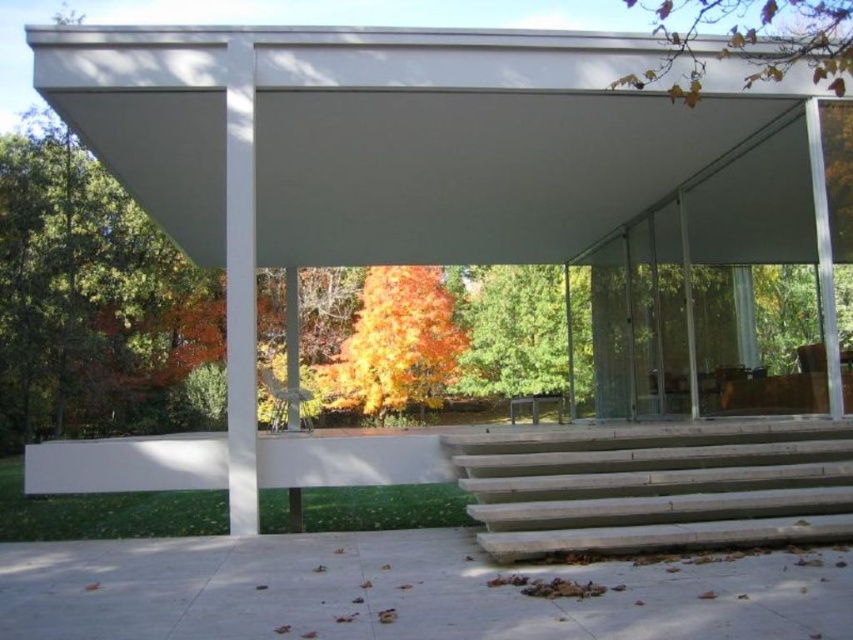
Question: Is white matte canopy at upper center in front of concrete stairs at lower right?

Choices:
 (A) no
 (B) yes

Answer: (A)

Question: Does white matte canopy at upper center have a greater width compared to orange leafy tree at center?

Choices:
 (A) yes
 (B) no

Answer: (A)

Question: Which point appears farthest from the camera in this image?

Choices:
 (A) (802, 36)
 (B) (846, 451)

Answer: (A)

Question: Which of these objects is positioned farthest from the green matte tree at center?

Choices:
 (A) concrete stairs at lower right
 (B) yellow leaves at upper right
 (C) white matte canopy at upper center
 (D) orange leafy tree at center

Answer: (A)

Question: Among these objects, which one is nearest to the camera?

Choices:
 (A) concrete stairs at lower right
 (B) white matte canopy at upper center
 (C) yellow leaves at upper right
 (D) orange leafy tree at center

Answer: (C)

Question: Does concrete stairs at lower right appear on the left side of yellow leaves at upper right?

Choices:
 (A) yes
 (B) no

Answer: (A)